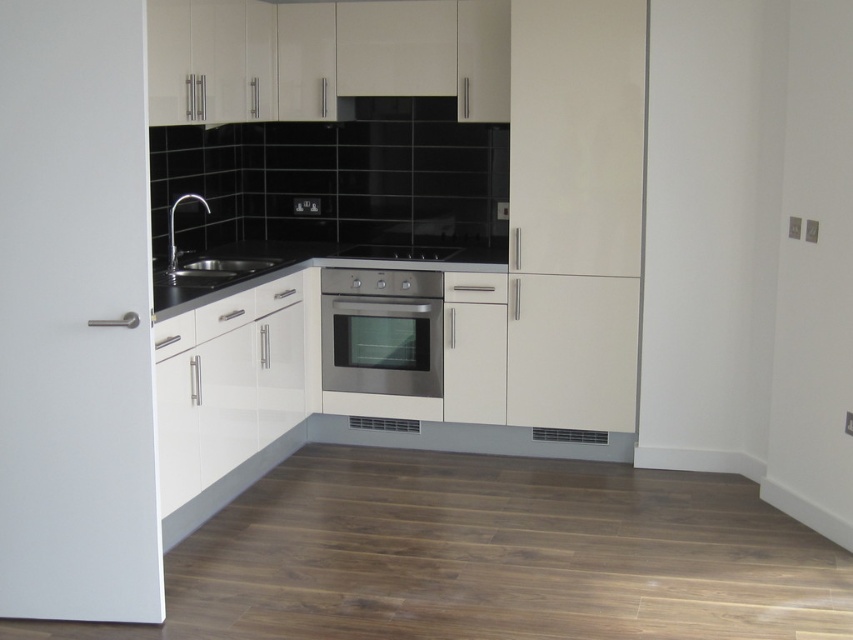
You are a kitchen designer planning to install a new appliance. You have a satin nickel sink at center and a stainless steel stove at center. Which appliance has a wider base to accommodate more countertop space?

The stainless steel stove at center has a wider base than the satin nickel sink at center, so it requires more countertop space.

You are a chef preparing to clean the kitchen. You need to wipe the stainless steel oven at center and the stainless steel stove at center. Which one should you clean first if you want to start from the lower part of the kitchen?

The stainless steel oven at center is positioned under the stainless steel stove at center, so you should clean the stainless steel oven at center first since it is lower down.